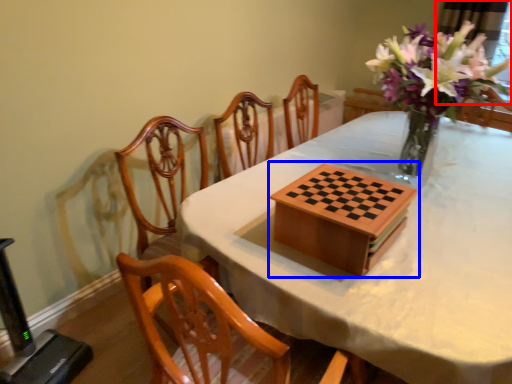
Question: Which object is closer to the camera taking this photo, window screen (highlighted by a red box) or board game (highlighted by a blue box)?

Choices:
 (A) window screen
 (B) board game

Answer: (B)